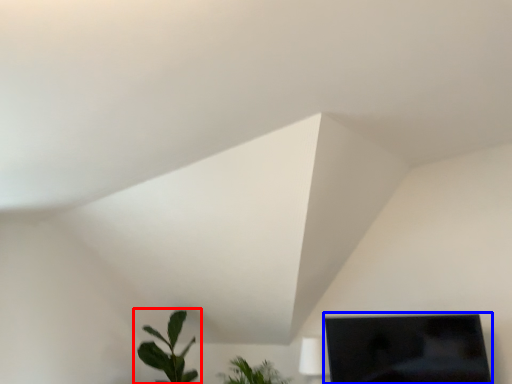
Question: Which object is closer to the camera taking this photo, houseplant (highlighted by a red box) or computer monitor (highlighted by a blue box)?

Choices:
 (A) houseplant
 (B) computer monitor

Answer: (B)